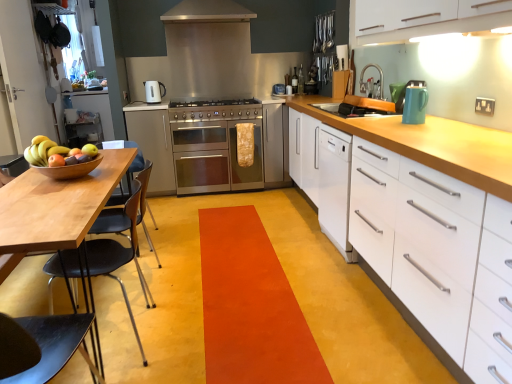
Find the location of a particular element. This screenshot has height=384, width=512. free spot to the right of black plastic chair at left is located at coordinates (181, 332).